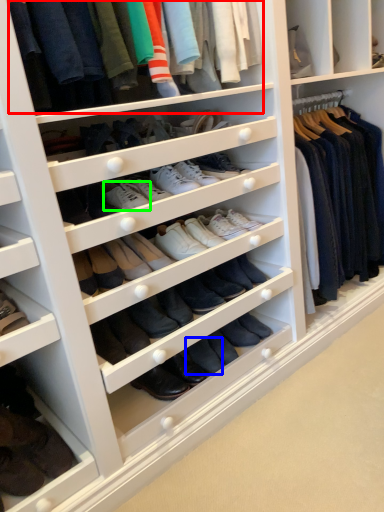
Question: Which object is the closest to the clothing (highlighted by a red box)? Choose among these: shoe (highlighted by a blue box) or shoe (highlighted by a green box).

Choices:
 (A) shoe
 (B) shoe

Answer: (B)